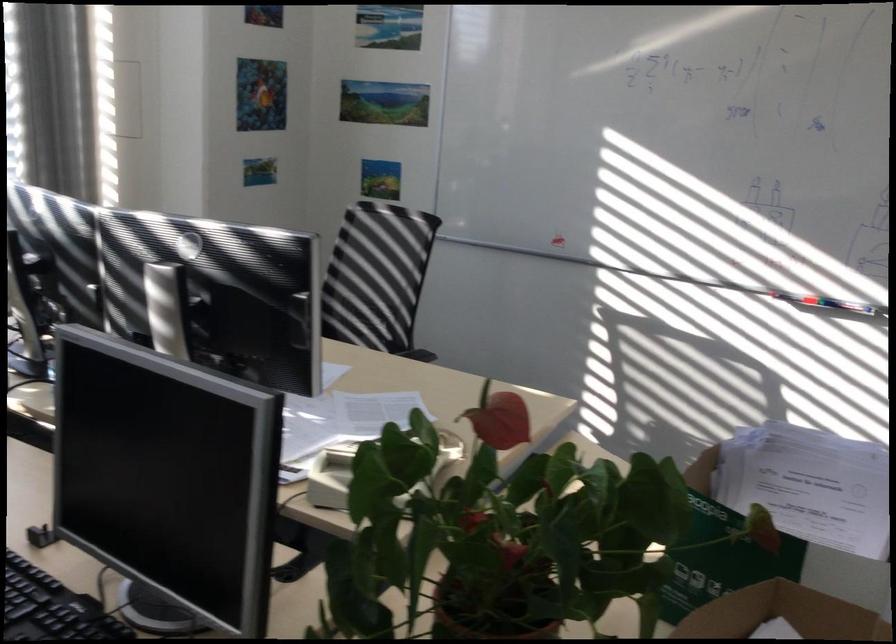
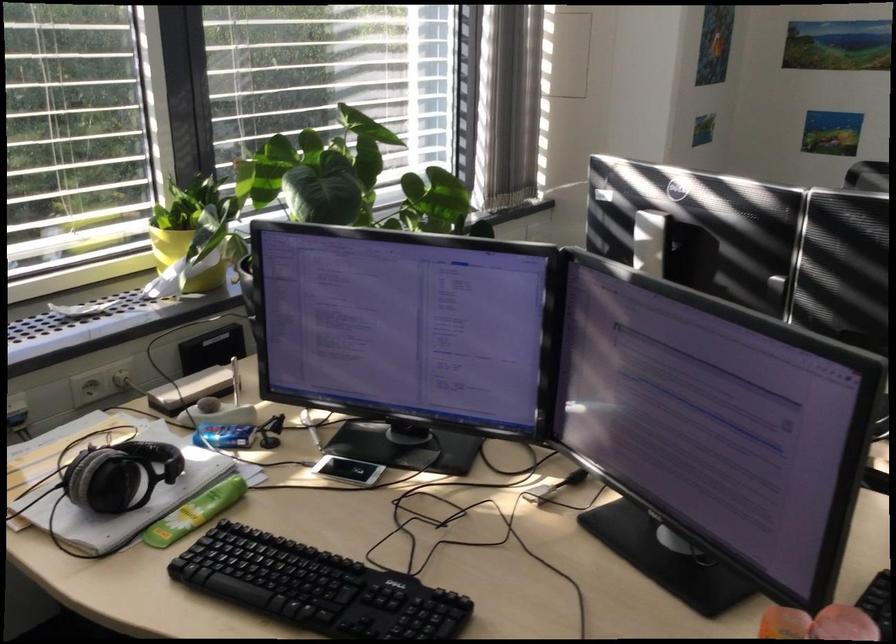
Question: What movement of the cameraman would produce the second image?

Choices:
 (A) Left
 (B) Right
 (C) Forward
 (D) Backward

Answer: (A)